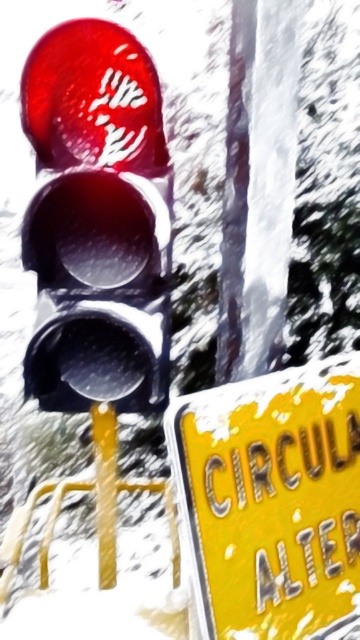
You are a pedestrian trying to cross the street and see the matte glass traffic light at left and the yellow matte sign at lower right. Which object is closer to the left edge of the image?

The matte glass traffic light at left is closer to the left edge of the image because it is positioned to the left of the yellow matte sign at lower right.

You are a delivery driver approaching an intersection in a snowy area. You see the matte glass traffic light at left and the yellow matte sign at lower right. Which object is taller?

The matte glass traffic light at left is taller than the yellow matte sign at lower right according to the description.

You are a driver approaching an intersection with a snowy road. You see the matte glass traffic light at left and the yellow matte sign at lower right. Which object is larger in your view?

The yellow matte sign at lower right is larger than the matte glass traffic light at left in your view.